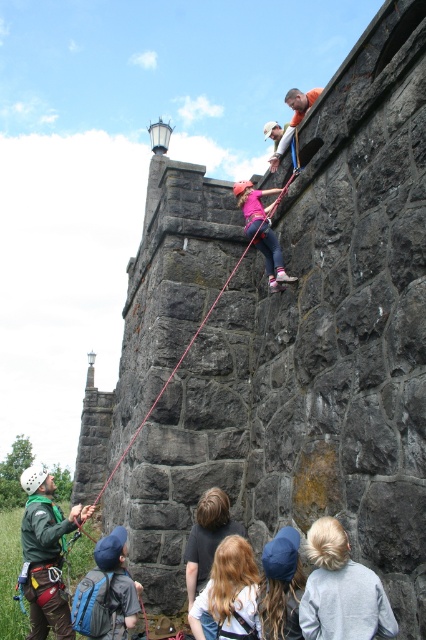
Question: Which point is closer to the camera?

Choices:
 (A) green fabric harness at lower left
 (B) blonde hair at center
 (C) red nylon rope at center
 (D) pink fabric climbing harness at center

Answer: (B)

Question: Does blonde hair at center have a larger size compared to pink fabric climbing harness at center?

Choices:
 (A) no
 (B) yes

Answer: (A)

Question: Estimate the real-world distances between objects in this image. Which object is closer to the red nylon rope at center?

Choices:
 (A) blonde hair at center
 (B) pink fabric climbing harness at center
 (C) green fabric harness at lower left

Answer: (C)

Question: Can you confirm if blonde hair at center is positioned to the right of pink fabric climbing harness at center?

Choices:
 (A) no
 (B) yes

Answer: (A)

Question: Is blonde hair at center to the right of red nylon rope at center from the viewer's perspective?

Choices:
 (A) yes
 (B) no

Answer: (A)

Question: Which of the following is the closest to the observer?

Choices:
 (A) (235, 566)
 (B) (267, 211)

Answer: (A)